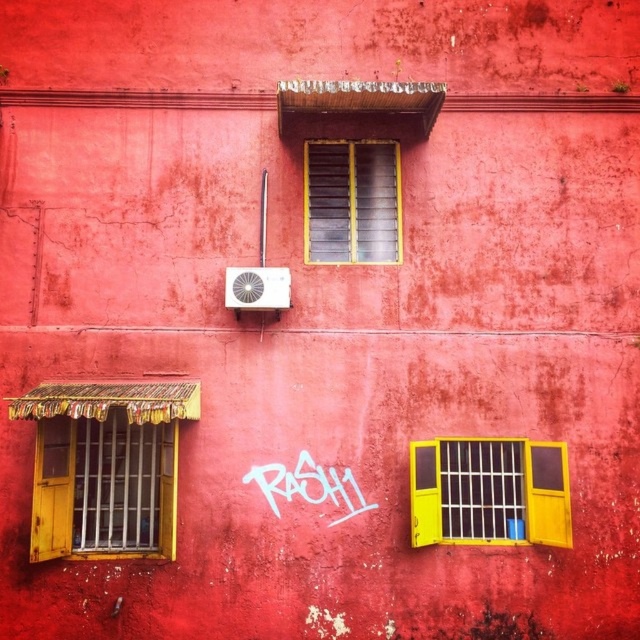
Is yellow matte window at lower right below yellow matte window at center?

Indeed, yellow matte window at lower right is positioned under yellow matte window at center.

Which is in front, point (445, 536) or point (356, 164)?

Point (445, 536) is more forward.

Locate an element on the screen. yellow matte window at lower right is located at coordinates (490, 492).

Is yellow matte window at lower right thinner than white graffiti at center?

In fact, yellow matte window at lower right might be wider than white graffiti at center.

At what (x,y) coordinates should I click in order to perform the action: click on yellow matte window at lower right. Please return your answer as a coordinate pair (x, y). Image resolution: width=640 pixels, height=640 pixels. Looking at the image, I should click on (490, 492).

Is yellow matte window at center taller than white graffiti at center?

Yes.

Does yellow matte window at center have a larger size compared to white graffiti at center?

Indeed, yellow matte window at center has a larger size compared to white graffiti at center.

Which is behind, point (371, 236) or point (356, 509)?

The point (371, 236) is behind.

Image resolution: width=640 pixels, height=640 pixels. What are the coordinates of `yellow matte window at center` in the screenshot? It's located at (352, 202).